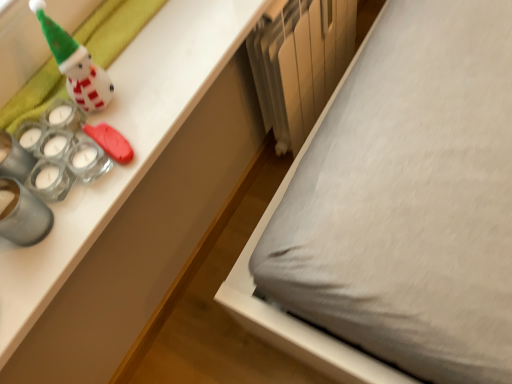
Question: Should I look upward or downward to see white glossy snowman at upper left?

Choices:
 (A) up
 (B) down

Answer: (A)

Question: Does white glossy desk at upper left come behind white glossy snowman at upper left?

Choices:
 (A) no
 (B) yes

Answer: (A)

Question: Can you confirm if white glossy desk at upper left is taller than white glossy snowman at upper left?

Choices:
 (A) yes
 (B) no

Answer: (B)

Question: From a real-world perspective, is white glossy desk at upper left beneath white glossy snowman at upper left?

Choices:
 (A) yes
 (B) no

Answer: (A)

Question: Does white glossy desk at upper left have a larger size compared to white glossy snowman at upper left?

Choices:
 (A) yes
 (B) no

Answer: (A)

Question: Is white glossy desk at upper left wider than white glossy snowman at upper left?

Choices:
 (A) no
 (B) yes

Answer: (B)

Question: From a real-world perspective, is white glossy desk at upper left on white glossy snowman at upper left?

Choices:
 (A) yes
 (B) no

Answer: (B)

Question: Are white glossy snowman at upper left and white glossy desk at upper left far apart?

Choices:
 (A) no
 (B) yes

Answer: (A)

Question: From the image's perspective, is white glossy snowman at upper left under white glossy desk at upper left?

Choices:
 (A) no
 (B) yes

Answer: (A)

Question: Can we say white glossy snowman at upper left lies outside white glossy desk at upper left?

Choices:
 (A) yes
 (B) no

Answer: (A)

Question: Is the depth of white glossy snowman at upper left greater than that of white glossy desk at upper left?

Choices:
 (A) no
 (B) yes

Answer: (B)

Question: Is white glossy snowman at upper left touching white glossy desk at upper left?

Choices:
 (A) no
 (B) yes

Answer: (A)

Question: From the image's perspective, is white glossy snowman at upper left above white glossy desk at upper left?

Choices:
 (A) yes
 (B) no

Answer: (A)

Question: Is metallic silver radiator at lower center turned away from white glossy desk at upper left?

Choices:
 (A) no
 (B) yes

Answer: (A)